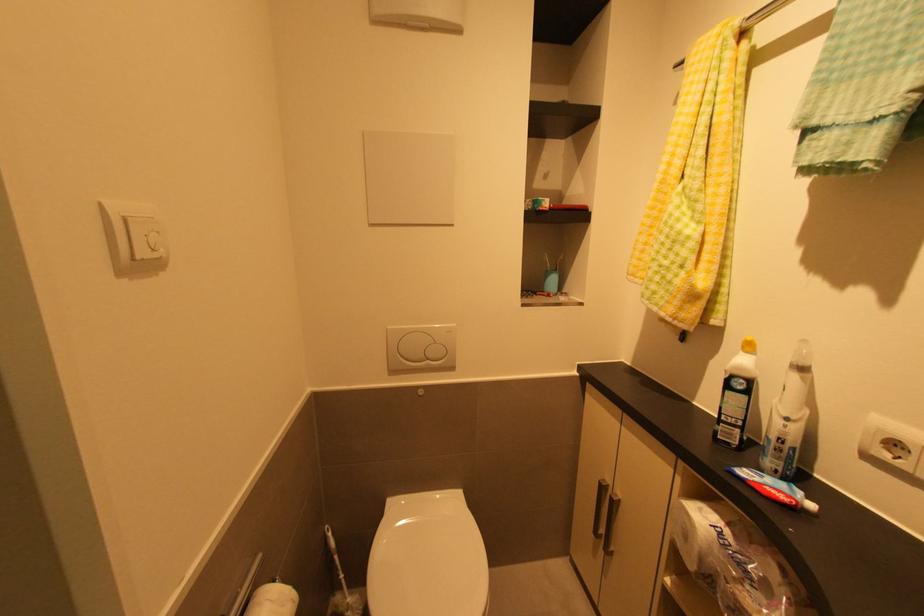
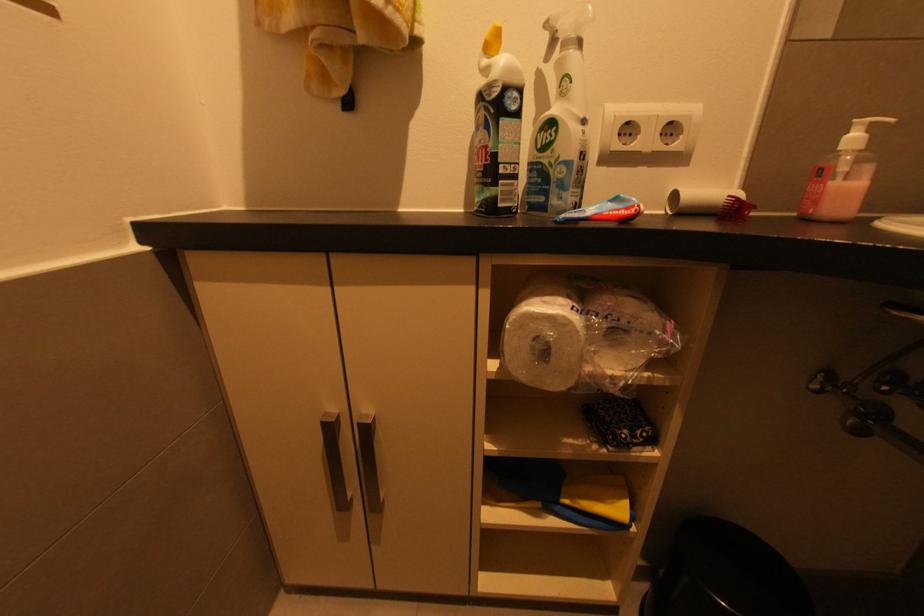
First-person continuous shooting, in which direction is the camera rotating?

The camera's rotation is toward right-down.